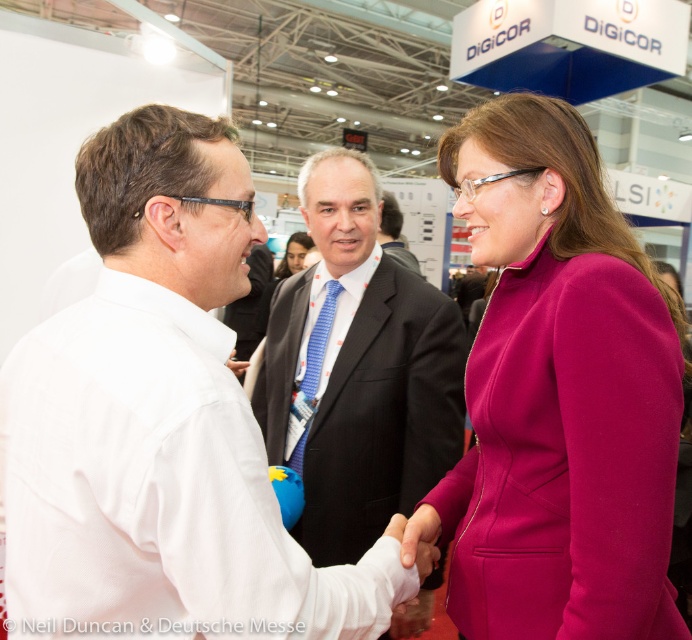
You are organizing a photo shoot and need to ensure that the fuchsia woolen suit at center and the dark suit at center are visible in the final image. Based on their positions, which suit is closer to the camera?

The fuchsia woolen suit at center is closer to the camera since it is in front of the dark suit at center.

You are a photographer at the event and need to capture a photo of the blue striped tie at center and the dark suit at center. Which object should you focus on first if you want to include both in the frame without moving the camera?

The blue striped tie at center is positioned on the left side of dark suit at center, so you should focus on the blue striped tie at center first to ensure both are within the frame.

You are a photographer at a professional event. You need to capture a photo of the fuchsia woolen suit at center and the blue striped tie at center. Based on their positions, which one should you focus on first to ensure both are in frame?

The fuchsia woolen suit at center is above the blue striped tie at center, so you should focus on the fuchsia woolen suit at center first to ensure both are in frame.